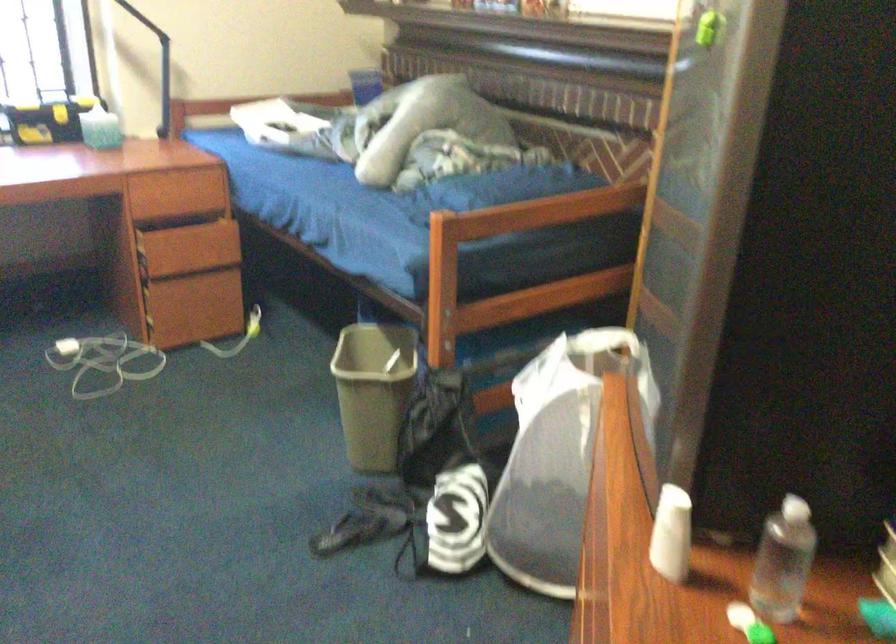
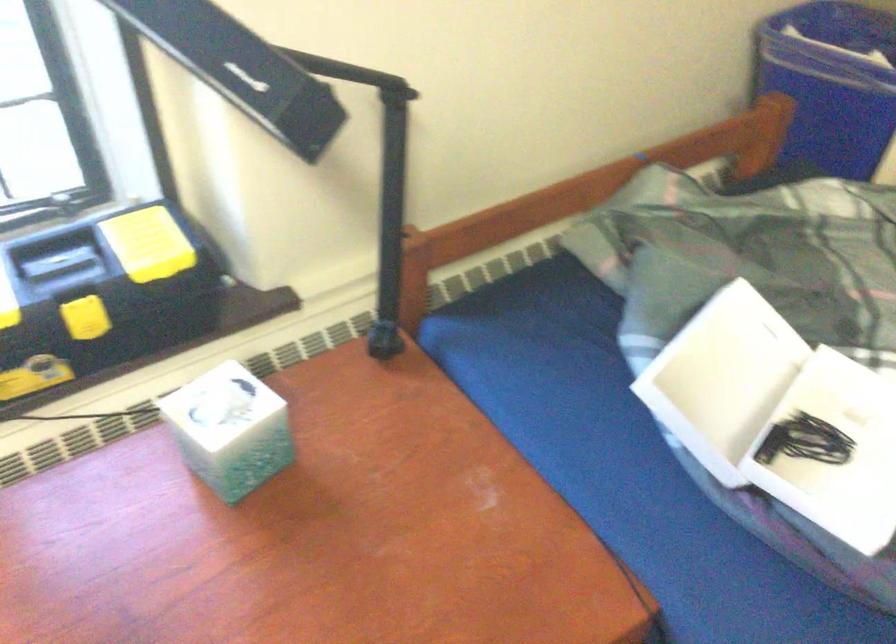
In the second image, find the point that corresponds to point (280, 120) in the first image.

(728, 365)